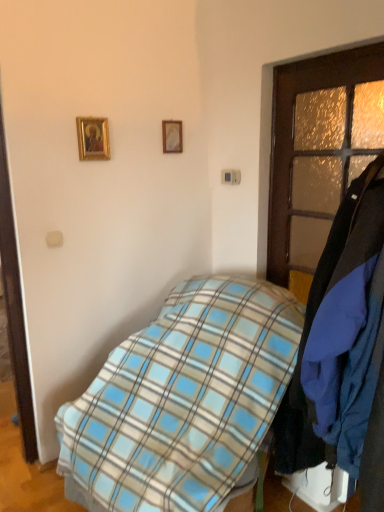
Question: Is gold-framed picture at upper center, the second picture frame when ordered from left to right, wider or thinner than blue plaid blanket at center?

Choices:
 (A) thin
 (B) wide

Answer: (A)

Question: Is gold-framed picture at upper center, the 2th picture frame when ordered from front to back, in front of or behind blue plaid blanket at center in the image?

Choices:
 (A) behind
 (B) front

Answer: (A)

Question: Estimate the real-world distances between objects in this image. Which object is farther from the blue plaid blanket at center?

Choices:
 (A) gold-framed picture at upper center, which is the first picture frame in back-to-front order
 (B) brown wooden door at right
 (C) gold-framed picture at upper left, the second picture frame positioned from the back

Answer: (A)

Question: Based on their relative distances, which object is nearer to the gold-framed picture at upper center, which is the first picture frame in back-to-front order?

Choices:
 (A) gold-framed picture at upper left, the second picture frame positioned from the back
 (B) brown wooden door at right
 (C) blue plaid blanket at center

Answer: (A)